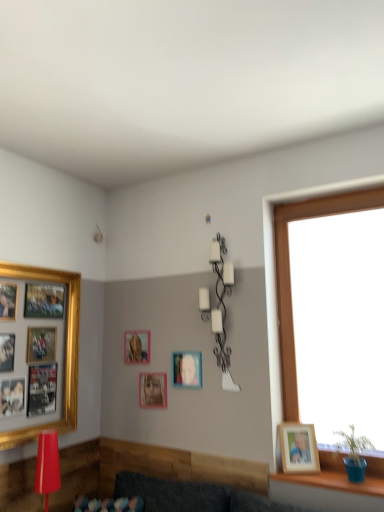
You are a GUI agent. You are given a task and a screenshot of the screen. Output one action in this format:
    pyautogui.click(x=<x>, y=<y>)
    Task: Click on the blank space situated above gold-framed collage at left, the first picture frame viewed from the left (from a real-world perspective)
    
    Given the screenshot: What is the action you would take?
    pyautogui.click(x=43, y=265)